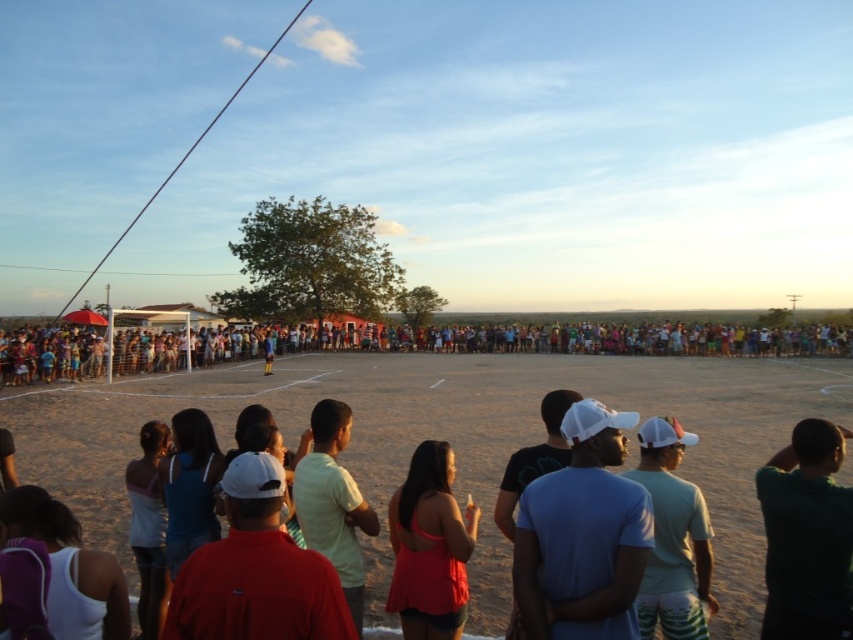
Which is more to the left, brown dirt field at center or white cap at center?

white cap at center

Is point (758, 419) positioned after point (643, 579)?

Yes, point (758, 419) is behind point (643, 579).

Between point (785, 390) and point (669, 611), which one is positioned in front?

Positioned in front is point (669, 611).

Find the location of a particular element. brown dirt field at center is located at coordinates (447, 440).

Which is above, white matte cap at center or matte pink tank top at center?

Positioned higher is white matte cap at center.

Does white matte cap at center appear on the left side of matte pink tank top at center?

Incorrect, white matte cap at center is not on the left side of matte pink tank top at center.

The image size is (853, 640). Describe the element at coordinates (583, 536) in the screenshot. I see `white matte cap at center` at that location.

You are a GUI agent. You are given a task and a screenshot of the screen. Output one action in this format:
    pyautogui.click(x=<x>, y=<y>)
    Task: Click on the white matte cap at center
    The height and width of the screenshot is (640, 853).
    Given the screenshot: What is the action you would take?
    pyautogui.click(x=583, y=536)

Between multicolored casual clothing at center and light yellow t-shirt at center, which one appears on the right side from the viewer's perspective?

multicolored casual clothing at center is more to the right.

What do you see at coordinates (532, 340) in the screenshot? Image resolution: width=853 pixels, height=640 pixels. I see `multicolored casual clothing at center` at bounding box center [532, 340].

Between point (119, 336) and point (306, 509), which one is positioned behind?

The point (119, 336) is more distant.

Locate an element on the screen. The image size is (853, 640). multicolored casual clothing at center is located at coordinates (532, 340).